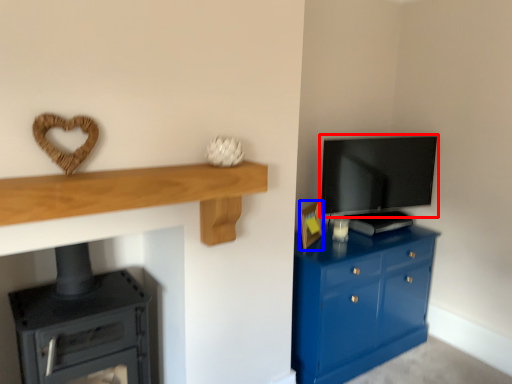
Question: Which object appears farthest to the camera in this image, television (highlighted by a red box) or picture frame (highlighted by a blue box)?

Choices:
 (A) television
 (B) picture frame

Answer: (A)